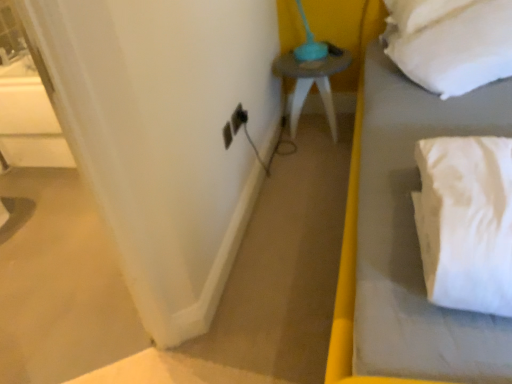
The image size is (512, 384). What are the coordinates of `vacant space underneath white fabric curtain at left (from a real-world perspective)` in the screenshot? It's located at (112, 364).